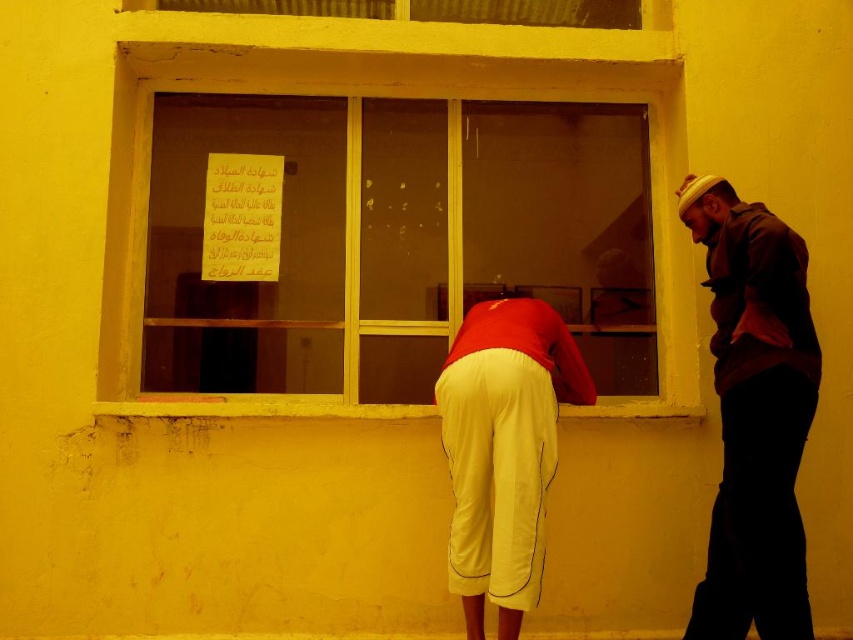
Question: Is transparent glass window at center thinner than dark brown leather jacket at right?

Choices:
 (A) no
 (B) yes

Answer: (A)

Question: Is transparent glass window at center to the left of dark brown leather jacket at right from the viewer's perspective?

Choices:
 (A) yes
 (B) no

Answer: (A)

Question: Among these objects, which one is farthest from the camera?

Choices:
 (A) transparent glass window at center
 (B) dark brown leather jacket at right
 (C) red fabric shirt at center

Answer: (A)

Question: Does red fabric shirt at center come behind dark brown leather jacket at right?

Choices:
 (A) yes
 (B) no

Answer: (A)

Question: Based on their relative distances, which object is nearer to the transparent glass window at center?

Choices:
 (A) red fabric shirt at center
 (B) dark brown leather jacket at right

Answer: (B)

Question: Which is nearer to the red fabric shirt at center?

Choices:
 (A) transparent glass window at center
 (B) dark brown leather jacket at right

Answer: (B)